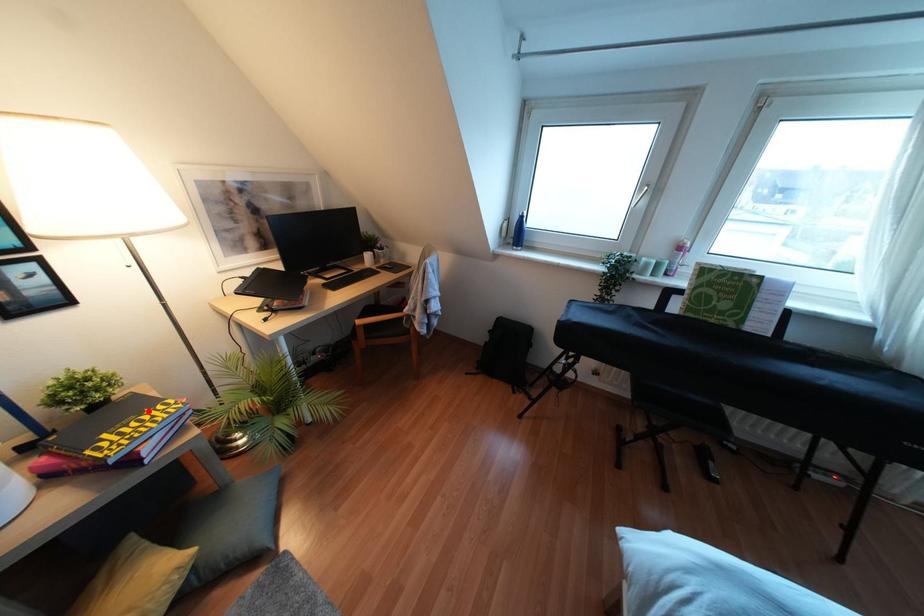
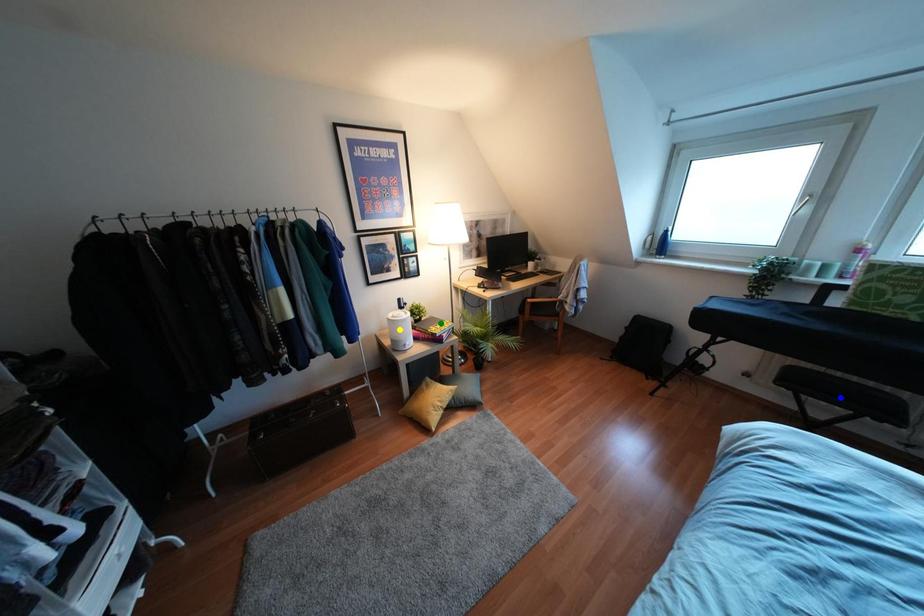
Question: I am providing you with two images of the same scene from different viewpoints. A red point is marked on the first image. You are given multiple points on the second image. In image 2, which mark is for the same physical point as the one in image 1?

Choices:
 (A) blue point
 (B) yellow point
 (C) green point

Answer: (C)